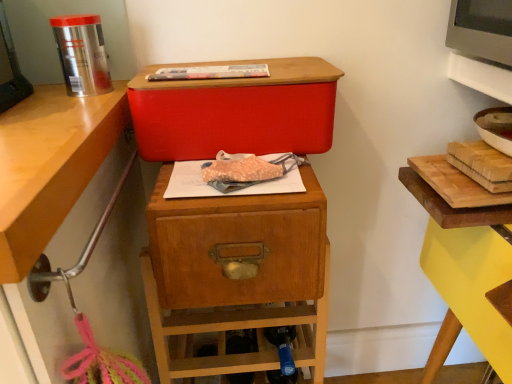
Question: Considering the relative sizes of wooden drawer at center and matte plastic baguette at center in the image provided, is wooden drawer at center taller than matte plastic baguette at center?

Choices:
 (A) no
 (B) yes

Answer: (B)

Question: Is wooden drawer at center at the left side of matte plastic baguette at center?

Choices:
 (A) yes
 (B) no

Answer: (B)

Question: Can you confirm if wooden drawer at center is positioned to the right of matte plastic baguette at center?

Choices:
 (A) no
 (B) yes

Answer: (B)

Question: From a real-world perspective, does wooden drawer at center sit lower than matte plastic baguette at center?

Choices:
 (A) yes
 (B) no

Answer: (A)

Question: From the image's perspective, does wooden drawer at center appear lower than matte plastic baguette at center?

Choices:
 (A) yes
 (B) no

Answer: (A)

Question: In terms of size, does wooden drawer at center appear bigger or smaller than matte red storage box at center?

Choices:
 (A) small
 (B) big

Answer: (B)

Question: From their relative heights in the image, would you say wooden drawer at center is taller or shorter than matte red storage box at center?

Choices:
 (A) short
 (B) tall

Answer: (B)

Question: Considering the relative positions of wooden drawer at center and matte red storage box at center in the image provided, is wooden drawer at center to the left or to the right of matte red storage box at center?

Choices:
 (A) right
 (B) left

Answer: (B)

Question: Does point (323, 211) appear closer or farther from the camera than point (328, 64)?

Choices:
 (A) farther
 (B) closer

Answer: (B)

Question: Considering the positions of matte red storage box at center and matte plastic baguette at center in the image, is matte red storage box at center wider or thinner than matte plastic baguette at center?

Choices:
 (A) thin
 (B) wide

Answer: (B)

Question: In terms of height, does matte red storage box at center look taller or shorter compared to matte plastic baguette at center?

Choices:
 (A) tall
 (B) short

Answer: (A)

Question: Based on their sizes in the image, would you say matte red storage box at center is bigger or smaller than matte plastic baguette at center?

Choices:
 (A) big
 (B) small

Answer: (A)

Question: From a real-world perspective, is matte red storage box at center positioned above or below matte plastic baguette at center?

Choices:
 (A) above
 (B) below

Answer: (B)

Question: Considering the positions of wooden drawer at center and matte plastic baguette at center in the image, is wooden drawer at center taller or shorter than matte plastic baguette at center?

Choices:
 (A) tall
 (B) short

Answer: (A)

Question: Is wooden drawer at center bigger or smaller than matte plastic baguette at center?

Choices:
 (A) big
 (B) small

Answer: (A)